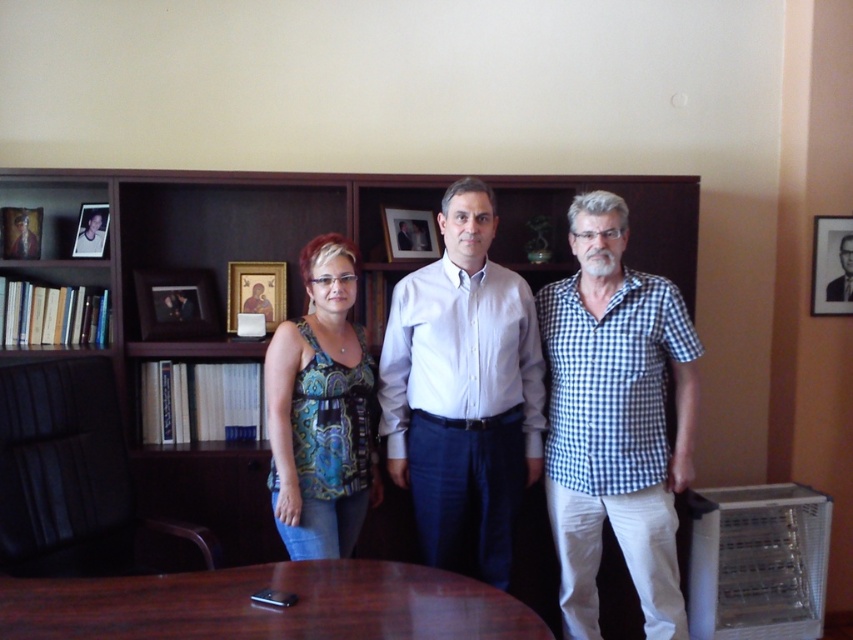
Which is below, gold wooden picture frame at upper center or wooden picture frame at left?

gold wooden picture frame at upper center

Which is more to the left, gold wooden picture frame at upper center or wooden picture frame at left?

Positioned to the left is wooden picture frame at left.

Which is behind, point (236, 298) or point (9, 228)?

Positioned behind is point (236, 298).

You are a GUI agent. You are given a task and a screenshot of the screen. Output one action in this format:
    pyautogui.click(x=<x>, y=<y>)
    Task: Click on the gold wooden picture frame at upper center
    The width and height of the screenshot is (853, 640).
    Given the screenshot: What is the action you would take?
    pyautogui.click(x=256, y=292)

Does point (688, 321) come closer to viewer compared to point (236, 636)?

No, (688, 321) is behind (236, 636).

Can you confirm if white checkered shirt at right is positioned below brown wooden table at center?

No.

Find the location of a particular element. white checkered shirt at right is located at coordinates (614, 420).

Can you confirm if gold wooden picture frame at upper center is positioned below matte plastic picture frame at upper left?

Yes, gold wooden picture frame at upper center is below matte plastic picture frame at upper left.

Between gold wooden picture frame at upper center and matte plastic picture frame at upper left, which one is positioned lower?

gold wooden picture frame at upper center

The image size is (853, 640). I want to click on gold wooden picture frame at upper center, so click(256, 292).

This screenshot has height=640, width=853. I want to click on gold wooden picture frame at upper center, so click(x=256, y=292).